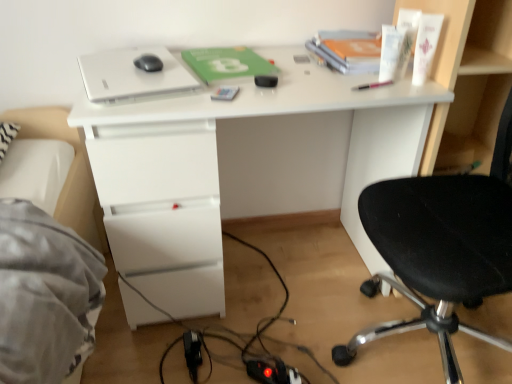
The height and width of the screenshot is (384, 512). Identify the location of vacant space to the right of metallic silver phone at center, the first stationery from the left. (286, 90).